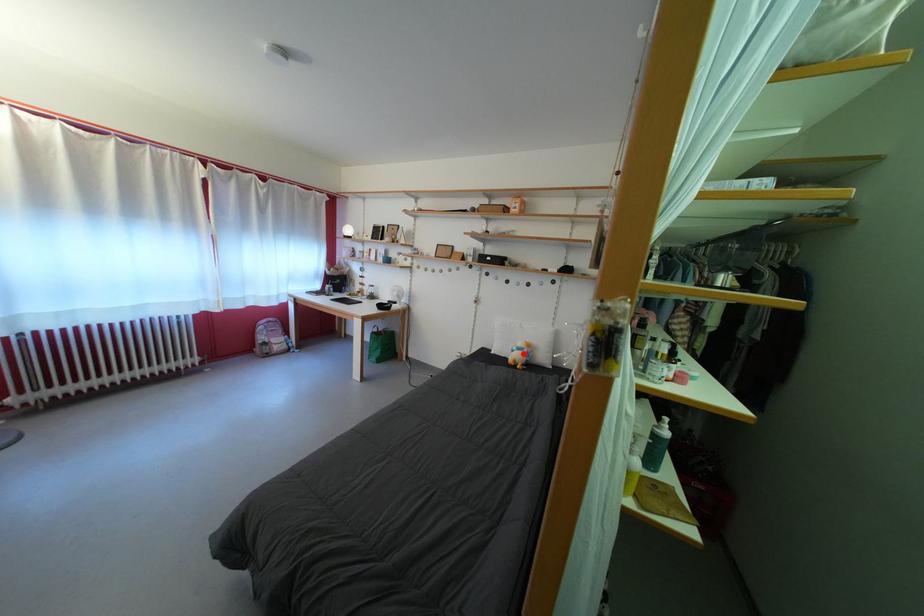
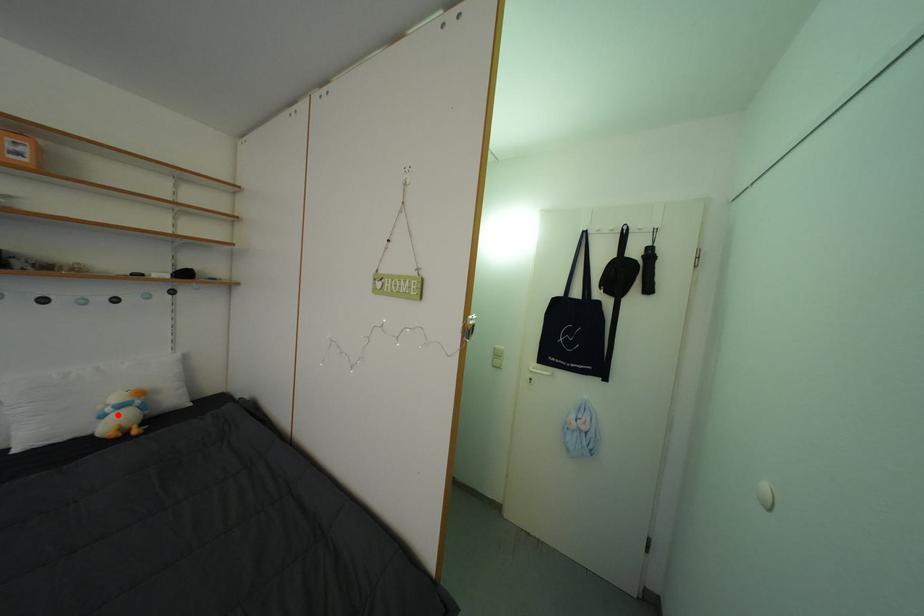
I am providing you with two images of the same scene from different viewpoints. A red point is marked on the first image and another point is marked on the second image. Is the marked point in image1 the same physical position as the marked point in image2?

Yes